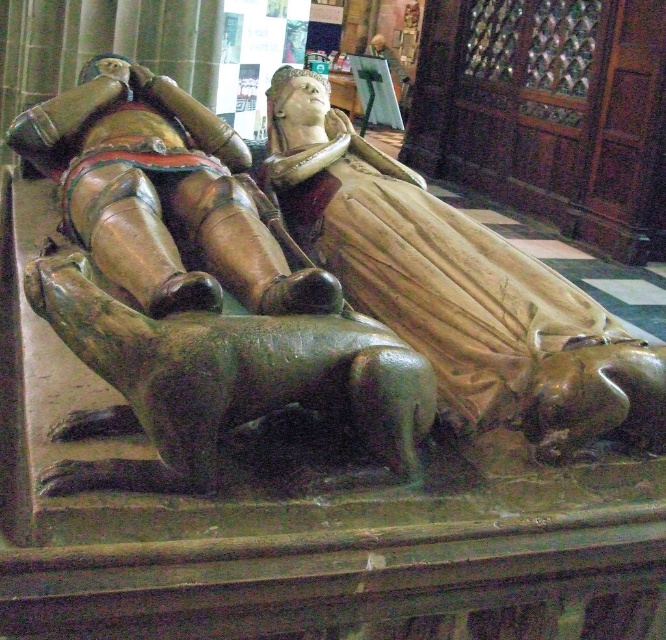
Does matte gold statue at center have a smaller size compared to polished bronze knight at center?

Yes, matte gold statue at center is smaller than polished bronze knight at center.

Is point (537, 428) more distant than point (93, 241)?

No.

At what (x,y) coordinates should I click in order to perform the action: click on matte gold statue at center. Please return your answer as a coordinate pair (x, y). Image resolution: width=666 pixels, height=640 pixels. Looking at the image, I should click on (456, 285).